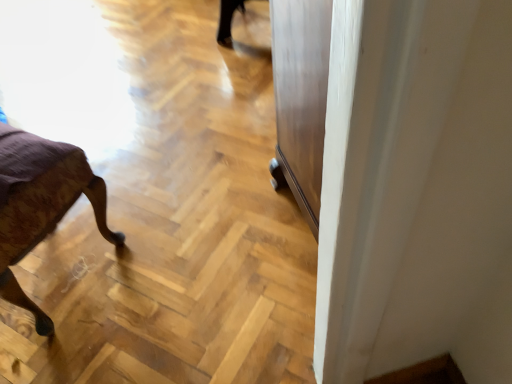
Image resolution: width=512 pixels, height=384 pixels. What do you see at coordinates (40, 203) in the screenshot?
I see `wooden upholstered chair at left` at bounding box center [40, 203].

Measure the distance between wooden upholstered chair at left and camera.

wooden upholstered chair at left is 37.08 inches from camera.

Where is `wooden upholstered chair at left`? The height and width of the screenshot is (384, 512). wooden upholstered chair at left is located at coordinates (40, 203).

At what (x,y) coordinates should I click in order to perform the action: click on wooden upholstered chair at left. Please return your answer as a coordinate pair (x, y). Looking at the image, I should click on (40, 203).